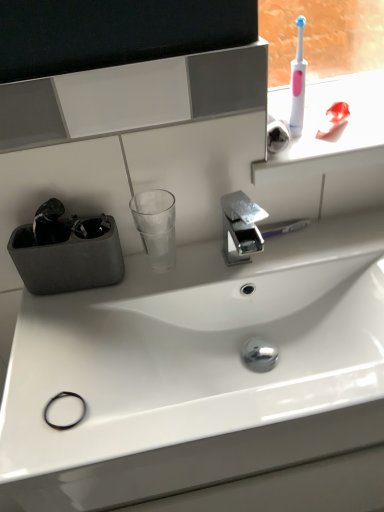
Where is `free space above pink plastic toothbrush at upper right (from a real-world perspective)`? free space above pink plastic toothbrush at upper right (from a real-world perspective) is located at coordinates (335, 121).